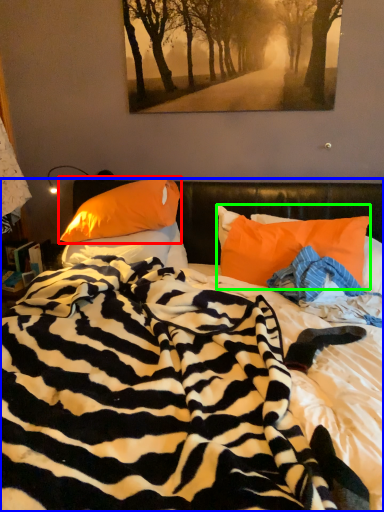
Question: Considering the real-world distances, which object is farthest from pillow (highlighted by a red box)? bed (highlighted by a blue box) or pillow (highlighted by a green box)?

Choices:
 (A) bed
 (B) pillow

Answer: (A)